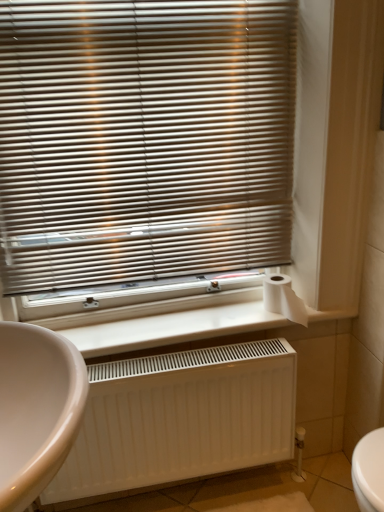
Question: In terms of height, does beige glossy sink at lower left look taller or shorter compared to white matte radiator at lower center?

Choices:
 (A) short
 (B) tall

Answer: (B)

Question: Would you say beige glossy sink at lower left is inside or outside white matte radiator at lower center?

Choices:
 (A) inside
 (B) outside

Answer: (B)

Question: Which of these objects is positioned closest to the beige glossy sink at lower left?

Choices:
 (A) white matte radiator at lower center
 (B) white matte radiator at lower center
 (C) metallic blinds at upper center
 (D) white matte toilet paper at right

Answer: (B)

Question: Estimate the real-world distances between objects in this image. Which object is closer to the white matte radiator at lower center?

Choices:
 (A) beige glossy sink at lower left
 (B) white matte radiator at lower center
 (C) metallic blinds at upper center
 (D) white matte toilet paper at right

Answer: (B)